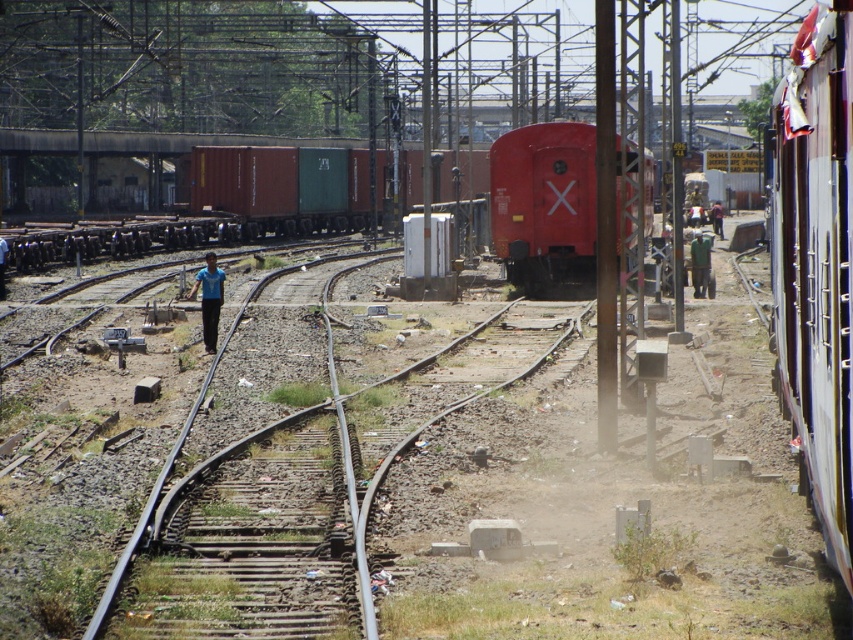
You are a maintenance worker checking the railway tracks. You notice the green matte container at center and the blue fabric shirt at center. Which object is taller?

The green matte container at center is taller than the blue fabric shirt at center.

You are a delivery person trying to locate a colleague wearing a green matte shirt at center in a railway yard. Based on the coordinates provided, where should you look to find them?

The green matte shirt at center is located at the 2D coordinates point (700, 264), so you should look towards the center area of the image where those coordinates intersect.

You are a safety inspector in the railway yard. You notice two workers, one wearing a green matte shirt at center and another in a blue shirt at left. According to safety protocols, workers must be positioned above the tracks to avoid potential hazards. Which worker is violating the safety protocol?

The green matte shirt at center is violating the safety protocol because it is located below the blue shirt at left, indicating it is positioned closer to or on the tracks where hazards may occur.